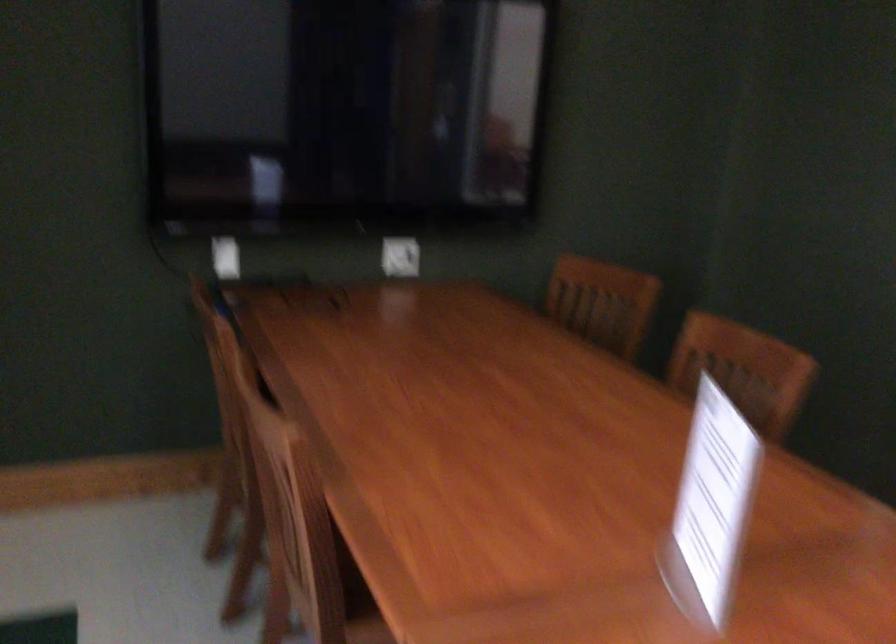
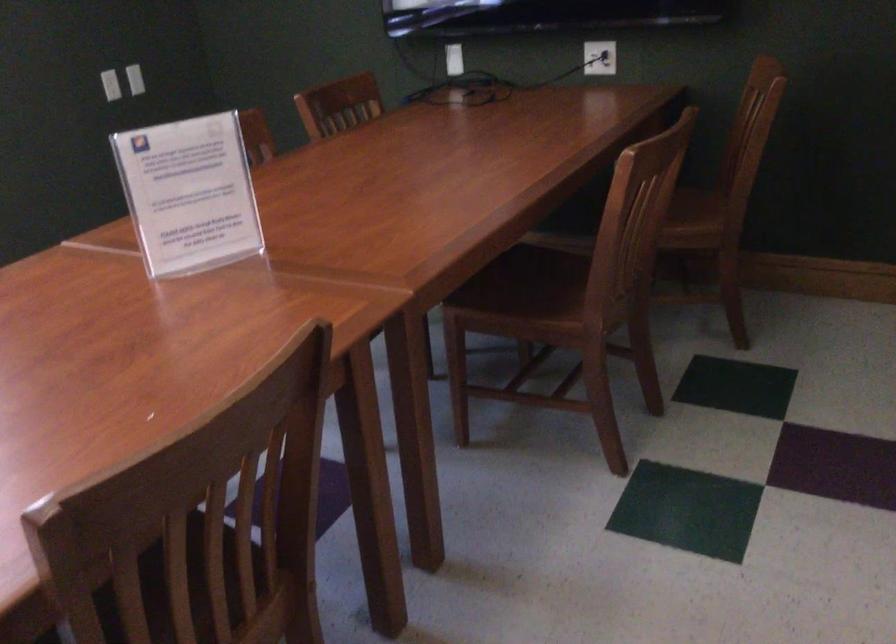
The point at (691, 491) is marked in the first image. Where is the corresponding point in the second image?

(188, 194)